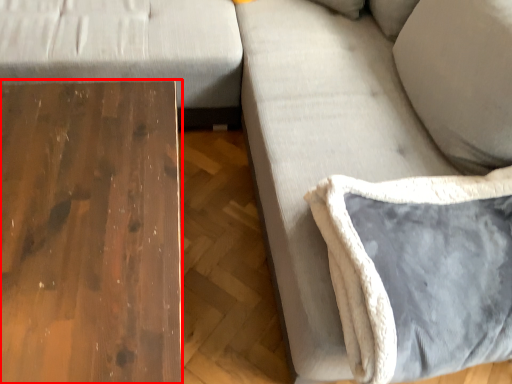
Question: From the image's perspective, what is the correct spatial positioning of table (annotated by the red box) in reference to pillow?

Choices:
 (A) below
 (B) above

Answer: (A)